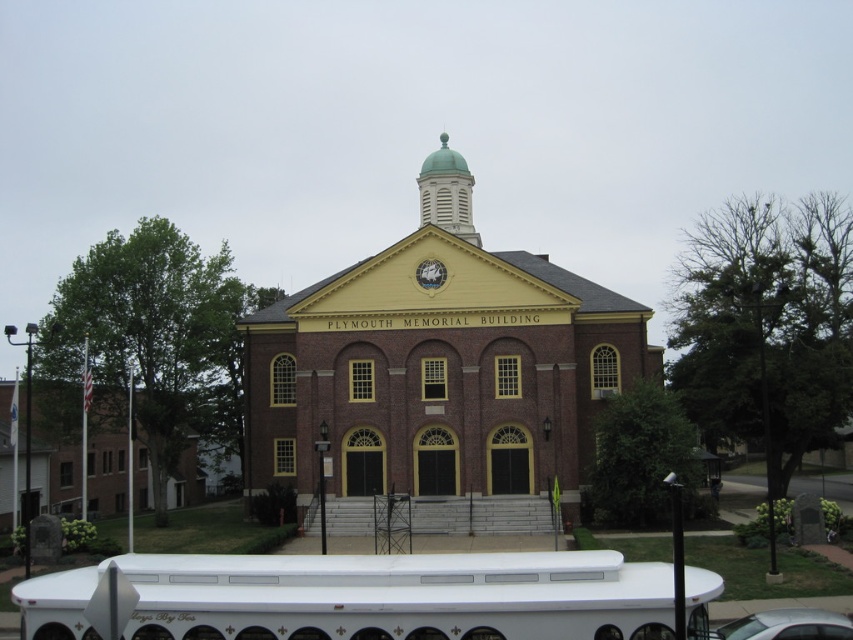
Is brick/yellow paint church at center further to camera compared to silver metallic car at lower right?

Yes.

Who is taller, brick/yellow paint church at center or silver metallic car at lower right?

Standing taller between the two is brick/yellow paint church at center.

The width and height of the screenshot is (853, 640). What are the coordinates of `brick/yellow paint church at center` in the screenshot? It's located at (438, 364).

Identify the location of brick/yellow paint church at center. (438, 364).